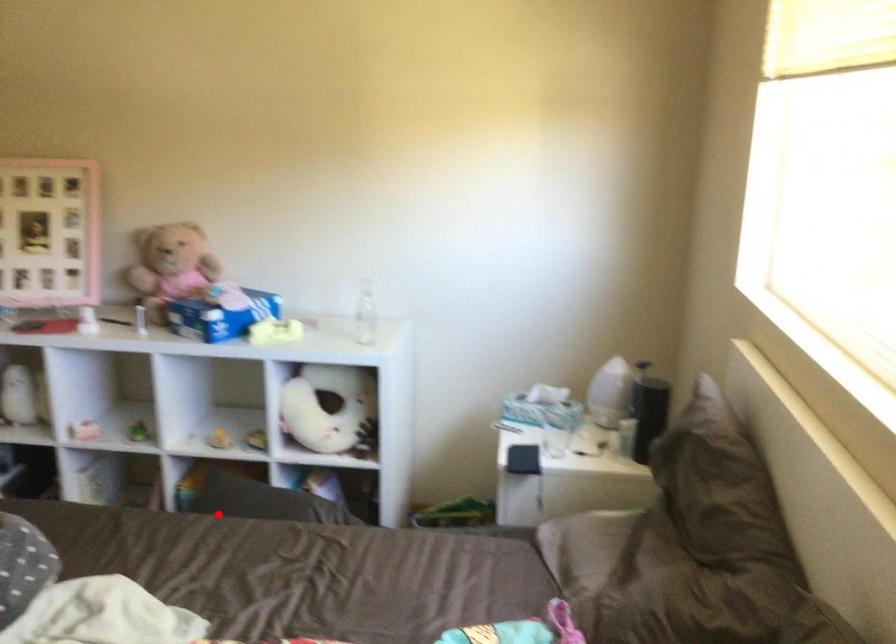
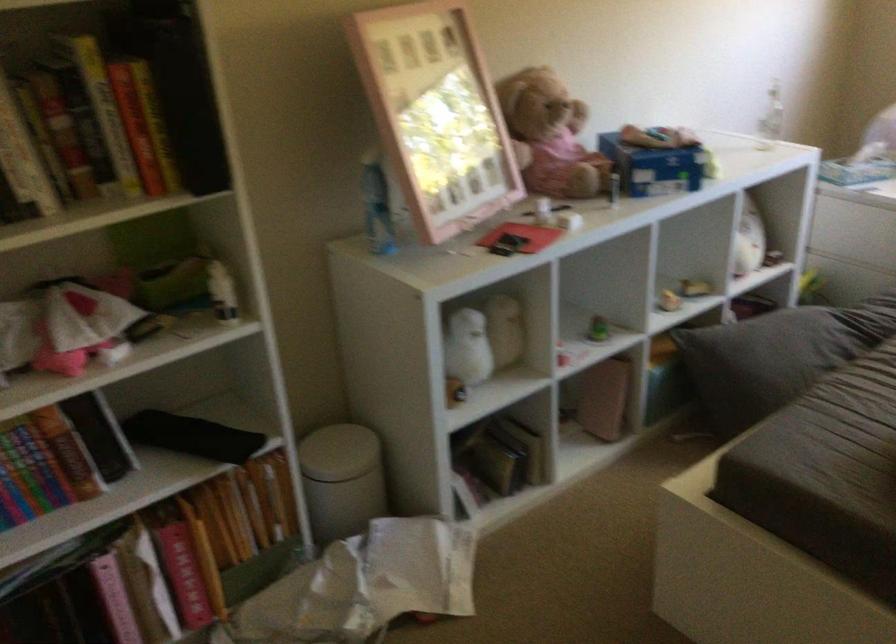
Question: I am providing you with two images of the same scene from different viewpoints. Image1 has a red point marked. In image2, the corresponding 3D location appears at what relative position? Reply with the corresponding letter.

Choices:
 (A) Closer
 (B) Farther

Answer: (A)